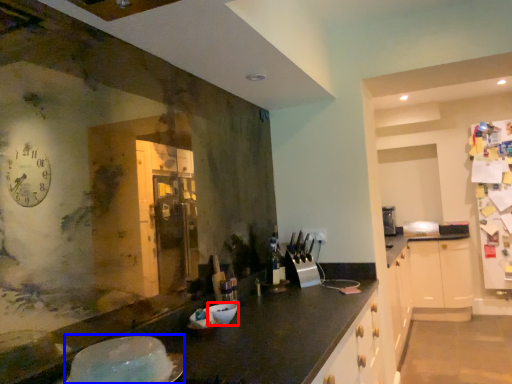
Question: Which object is closer to the camera taking this photo, bowl (highlighted by a red box) or appliance (highlighted by a blue box)?

Choices:
 (A) bowl
 (B) appliance

Answer: (B)